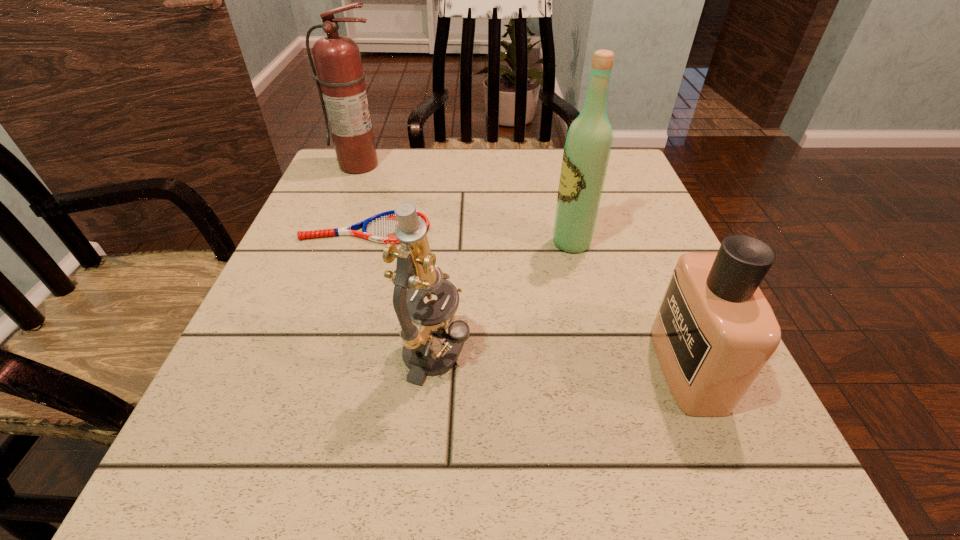
This screenshot has height=540, width=960. I want to click on free space located on the left of the third tallest object, so click(x=252, y=353).

The width and height of the screenshot is (960, 540). Find the location of `free spot located 0.070m on the front label of the rightmost object`. free spot located 0.070m on the front label of the rightmost object is located at coordinates (614, 367).

Locate an element on the screen. free space located 0.290m on the front label of the rightmost object is located at coordinates tap(470, 367).

Find the location of a particular element. This screenshot has height=540, width=960. free space located 0.170m on the front label of the rightmost object is located at coordinates (549, 367).

Locate an element on the screen. Image resolution: width=960 pixels, height=540 pixels. vacant region located 0.270m on the back of the shortest object is located at coordinates (390, 156).

You are a GUI agent. You are given a task and a screenshot of the screen. Output one action in this format:
    pyautogui.click(x=<x>, y=<y>)
    Task: Click on the object present at the far edge
    The width and height of the screenshot is (960, 540).
    Given the screenshot: What is the action you would take?
    pyautogui.click(x=340, y=81)

The width and height of the screenshot is (960, 540). What are the coordinates of `fire extinguisher at the left edge` in the screenshot? It's located at (340, 81).

Identify the location of tennis racket present at the left edge. The height and width of the screenshot is (540, 960). (380, 228).

Identify the location of wine bottle that is at the right edge. The height and width of the screenshot is (540, 960). (588, 144).

Locate an element on the screen. perfume that is at the right edge is located at coordinates (714, 332).